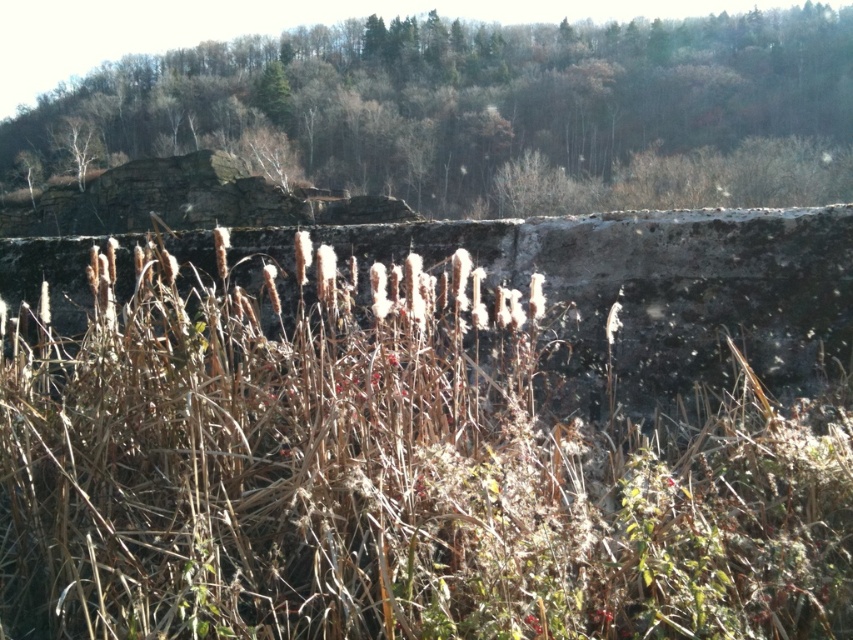
Does brown grass at center come behind brown dry grass at center?

No, it is in front of brown dry grass at center.

Can you confirm if brown grass at center is positioned to the left of brown dry grass at center?

No, brown grass at center is not to the left of brown dry grass at center.

Between point (843, 314) and point (204, 92), which one is positioned in front?

Point (843, 314) is in front.

You are a GUI agent. You are given a task and a screenshot of the screen. Output one action in this format:
    pyautogui.click(x=<x>, y=<y>)
    Task: Click on the brown grass at center
    
    Given the screenshot: What is the action you would take?
    pyautogui.click(x=418, y=440)